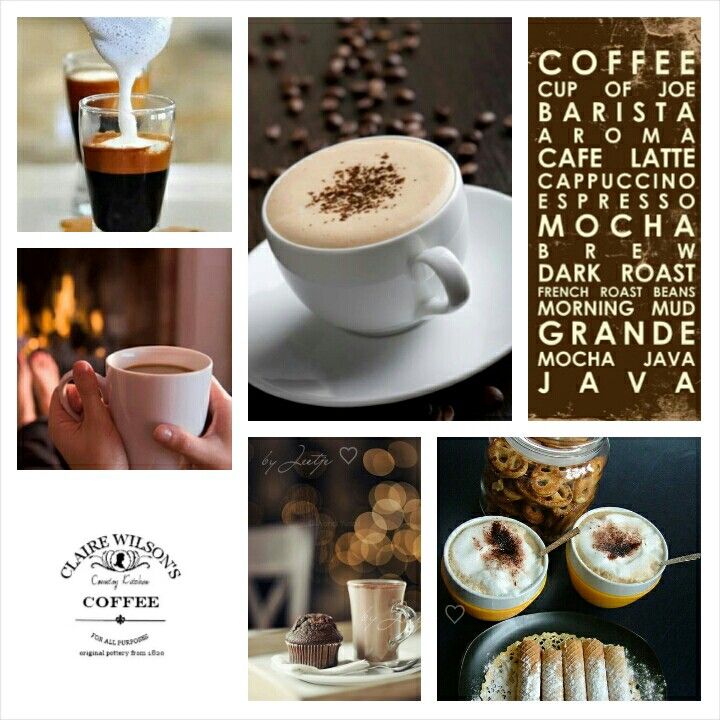
The height and width of the screenshot is (720, 720). What are the coordinates of `cups of coffee` in the screenshot? It's located at point(101,127), point(171,369), point(91,68), point(374,270), point(374,603), point(531,562), point(612,554).